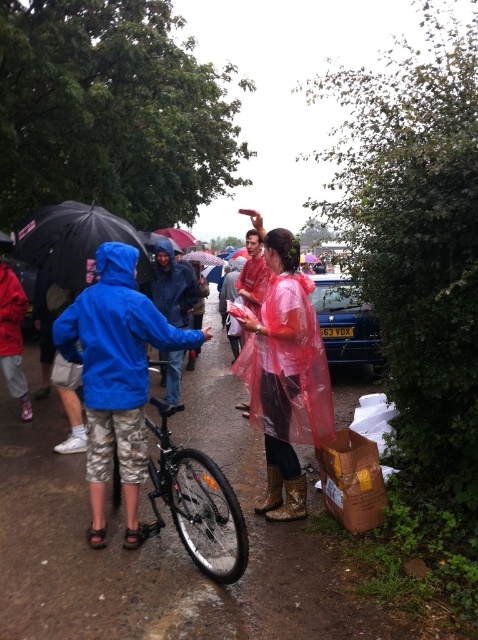
You are a delivery person who needs to carry a package that is 1.2 meters wide. You see a transparent plastic raincoat at center and a blue metallic car at center. Which object can you place the package next to without it overlapping?

The blue metallic car at center has greater width than the transparent plastic raincoat at center, so the package can be placed next to the blue metallic car at center without overlapping.

You are a pedestrian trying to cross the path. You see the black matte umbrella at left and the transparent plastic umbrella at center. Which umbrella is closer to the left side of the path?

The transparent plastic umbrella at center is closer to the left side of the path because the black matte umbrella at left is positioned to its right.

You are standing in the middle of a narrow path on a rainy day. You see a black matte umbrella at left. Can you reach the umbrella within 5 meters without moving?

The black matte umbrella at left is 4.57 meters away from you, so yes, you can reach it within 5 meters without moving.